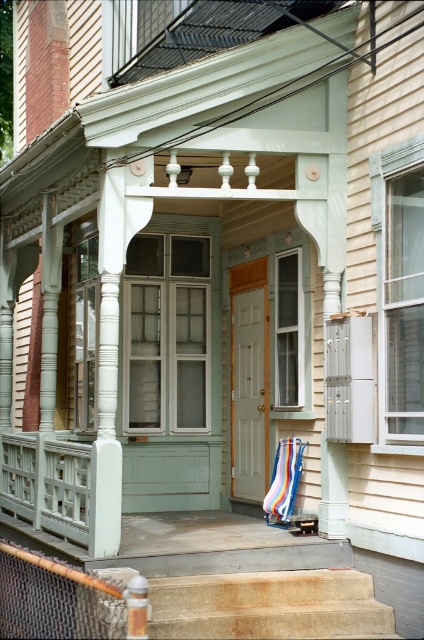
Question: Which object appears farthest from the camera in this image?

Choices:
 (A) smooth stone stairs at center
 (B) striped fabric beach chair at center

Answer: (B)

Question: Which point appears closest to the camera in this image?

Choices:
 (A) (276, 458)
 (B) (186, 630)

Answer: (B)

Question: Can you confirm if smooth stone stairs at center is positioned to the left of striped fabric beach chair at center?

Choices:
 (A) yes
 (B) no

Answer: (A)

Question: Does smooth stone stairs at center have a larger size compared to striped fabric beach chair at center?

Choices:
 (A) yes
 (B) no

Answer: (A)

Question: Is the position of smooth stone stairs at center more distant than that of striped fabric beach chair at center?

Choices:
 (A) no
 (B) yes

Answer: (A)